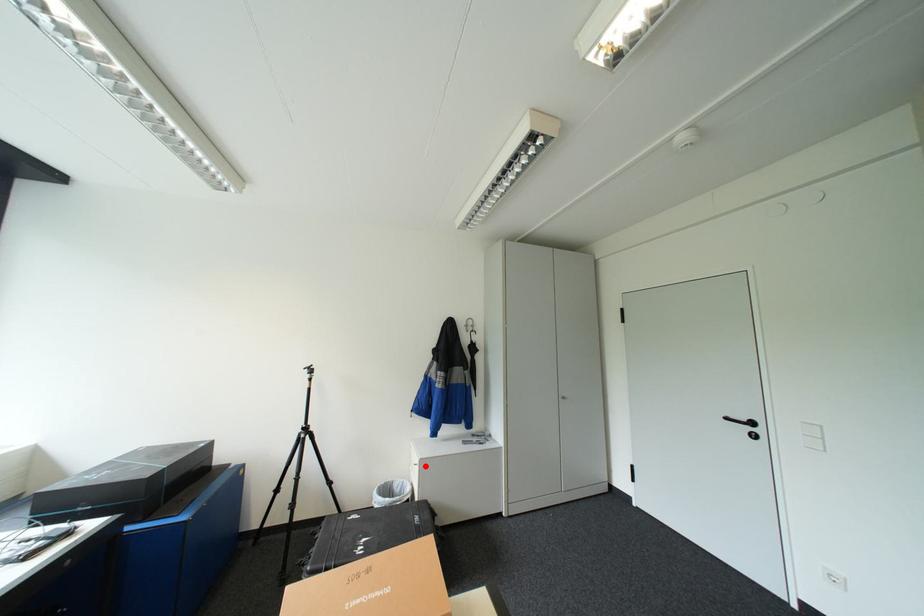
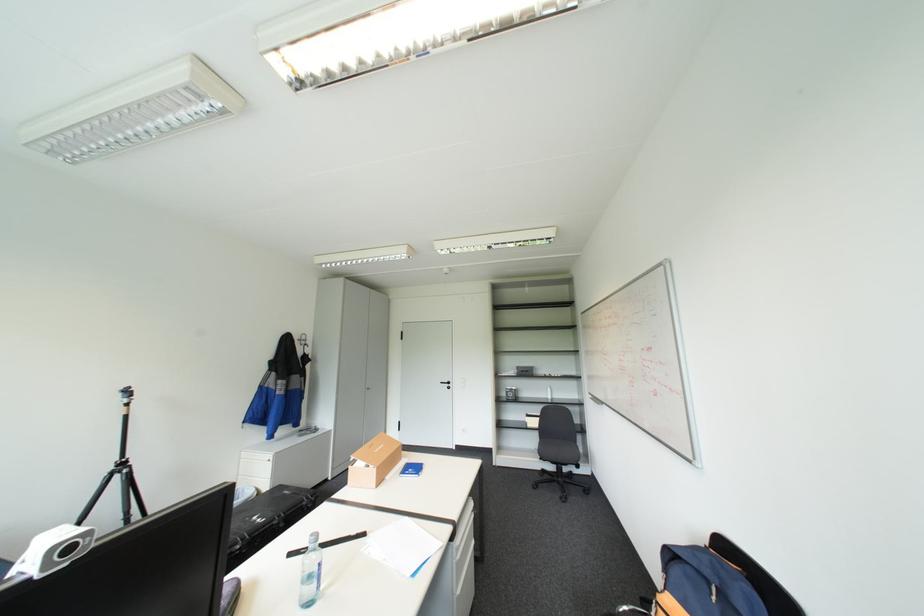
Question: I am providing you with two images of the same scene from different viewpoints. Image1 has a red point marked. In image2, the corresponding 3D location appears at what relative position? Reply with the corresponding letter.

Choices:
 (A) Closer
 (B) Farther

Answer: (A)